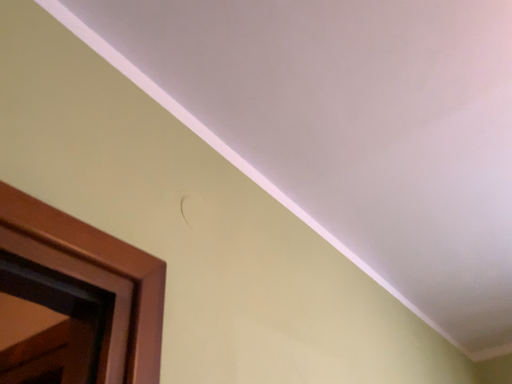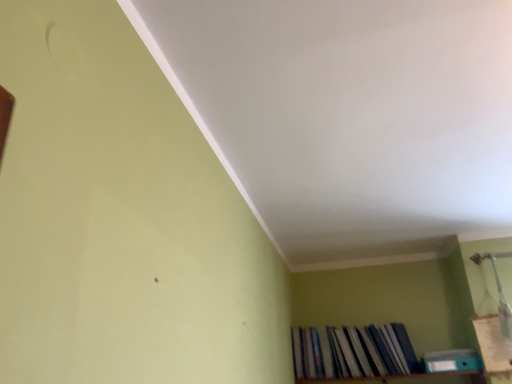
Question: How did the camera likely rotate when shooting the video?

Choices:
 (A) rotated right
 (B) rotated left

Answer: (A)